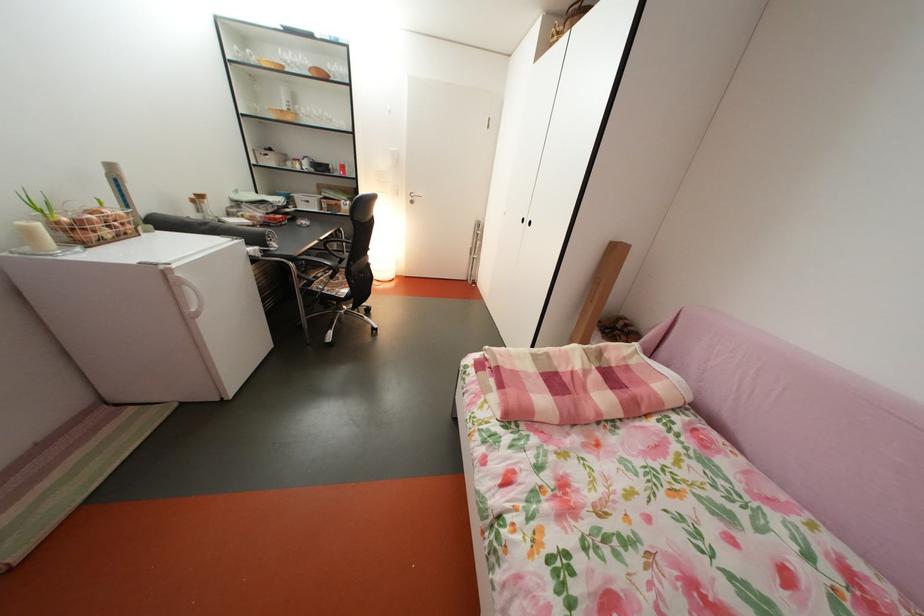
Where is `silver door handle`? The width and height of the screenshot is (924, 616). silver door handle is located at coordinates (412, 197).